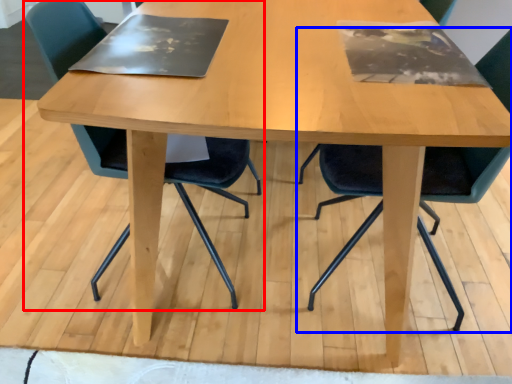
Question: Which point is further to the camera, chair (highlighted by a red box) or chair (highlighted by a blue box)?

Choices:
 (A) chair
 (B) chair

Answer: (A)